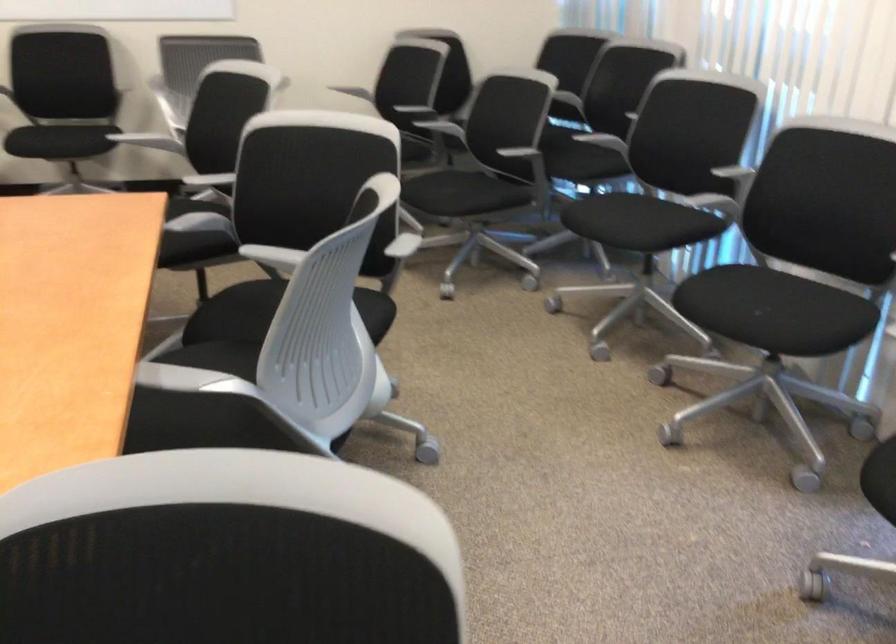
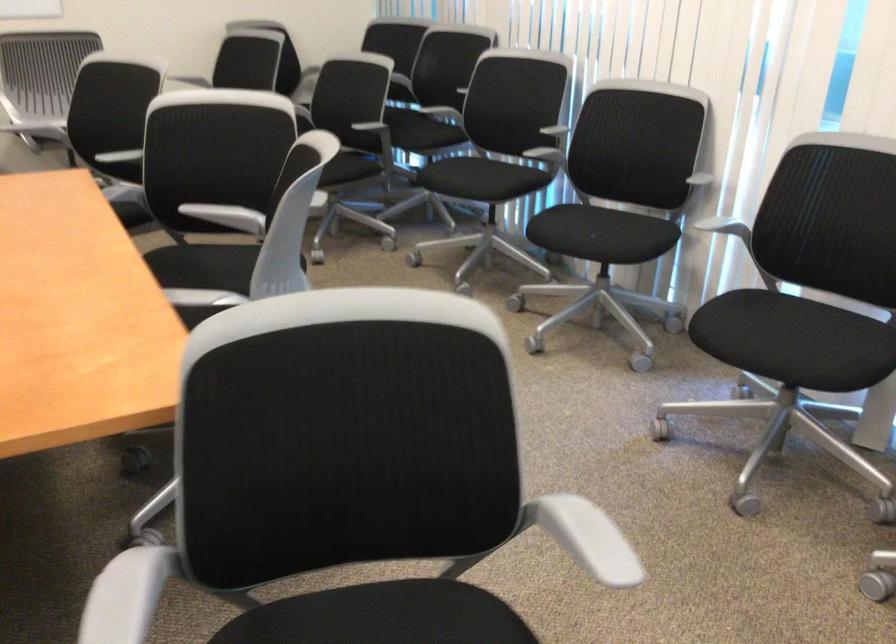
Where in the second image is the point corresponding to [633,223] from the first image?

(480, 178)